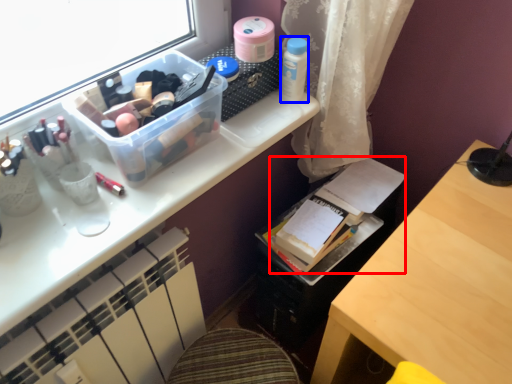
Question: Which of the following is the closest to the observer, book (highlighted by a red box) or toiletry (highlighted by a blue box)?

Choices:
 (A) book
 (B) toiletry

Answer: (B)